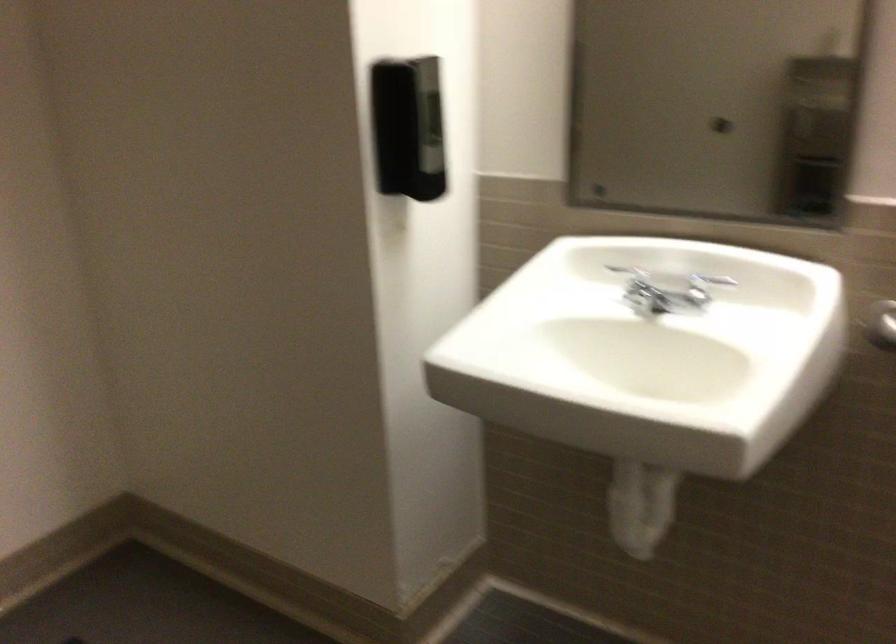
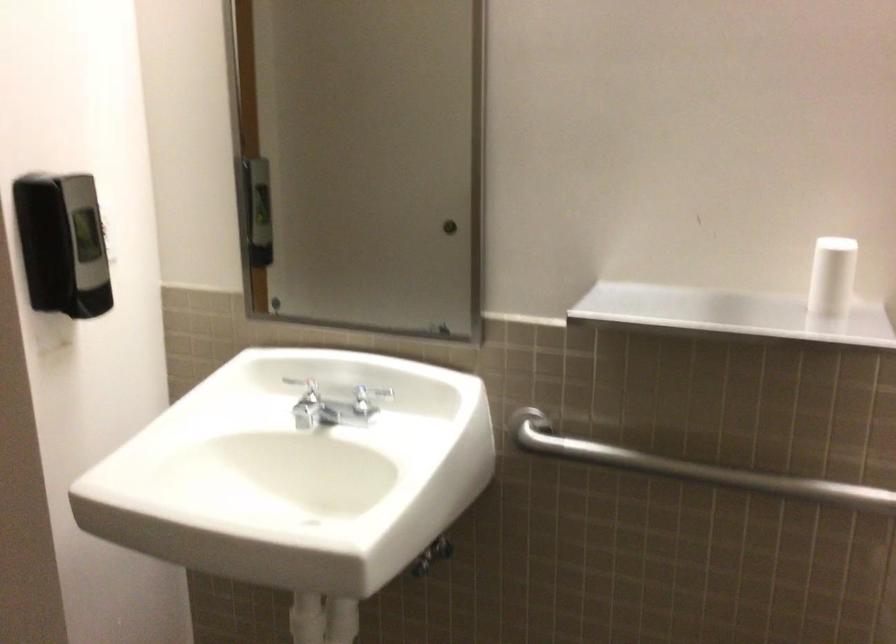
Where in the second image is the point corresponding to point 645,509 from the first image?

(325, 623)